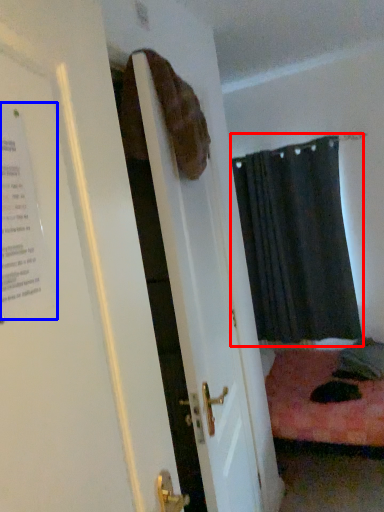
Question: Which object appears farthest to the camera in this image, curtain (highlighted by a red box) or poster (highlighted by a blue box)?

Choices:
 (A) curtain
 (B) poster

Answer: (A)